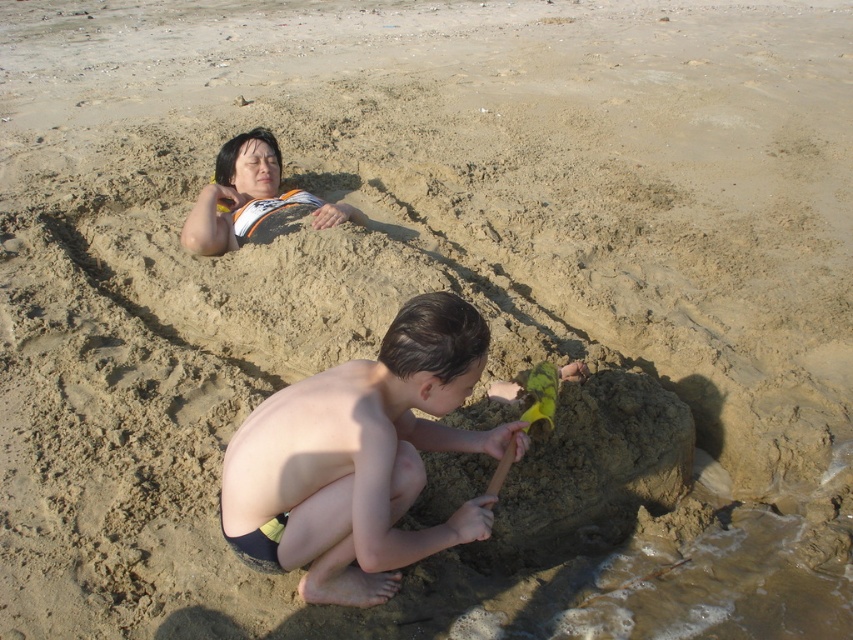
Question: Can you confirm if smooth tan skin at center is positioned above orange and white t-shirt at upper left?

Choices:
 (A) no
 (B) yes

Answer: (A)

Question: Which point is closer to the camera taking this photo?

Choices:
 (A) (407, 490)
 (B) (206, 204)

Answer: (A)

Question: Is smooth tan skin at center behind orange and white t-shirt at upper left?

Choices:
 (A) no
 (B) yes

Answer: (A)

Question: Is smooth tan skin at center above orange and white t-shirt at upper left?

Choices:
 (A) no
 (B) yes

Answer: (A)